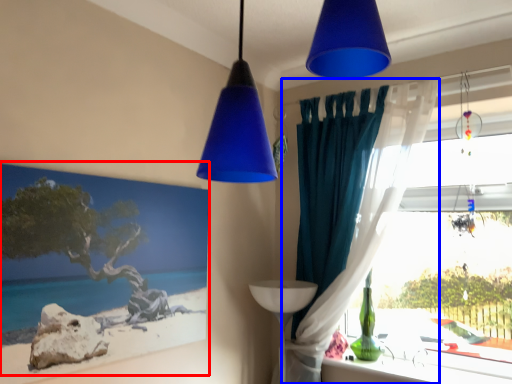
Question: Among these objects, which one is farthest to the camera, picture frame (highlighted by a red box) or curtain (highlighted by a blue box)?

Choices:
 (A) picture frame
 (B) curtain

Answer: (B)